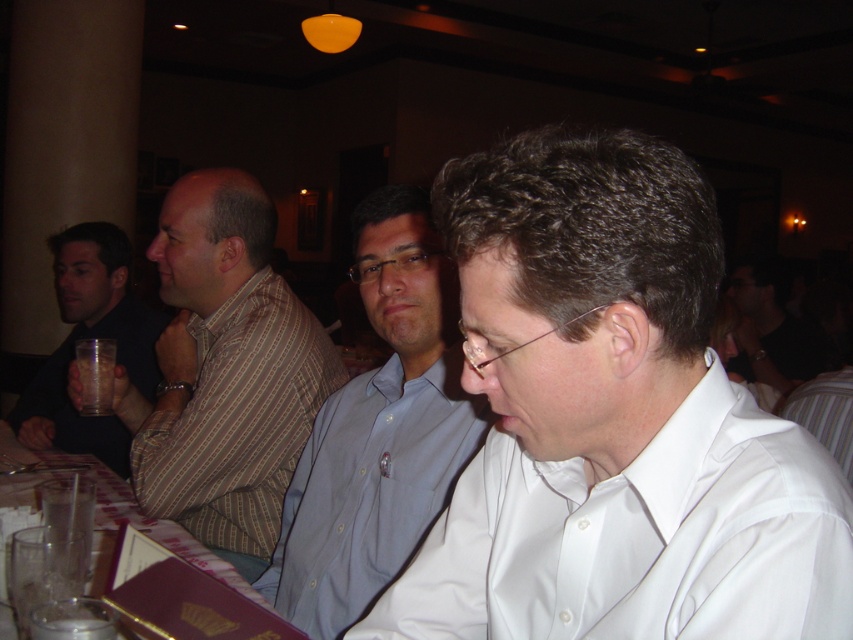
The image size is (853, 640). What are the coordinates of `translucent glass water at lower left` in the screenshot? It's located at (107, 506).

The height and width of the screenshot is (640, 853). Describe the element at coordinates (107, 506) in the screenshot. I see `translucent glass water at lower left` at that location.

Is point (206, 557) closer to camera compared to point (99, 349)?

Yes, it is.

The width and height of the screenshot is (853, 640). Find the location of `translucent glass water at lower left`. translucent glass water at lower left is located at coordinates (107, 506).

Is striped cotton shirt at left positioned at the back of white shirt at center?

No, it is not.

Is striped cotton shirt at left to the left of white shirt at center from the viewer's perspective?

Correct, you'll find striped cotton shirt at left to the left of white shirt at center.

Which is in front, point (165, 285) or point (781, 355)?

Positioned in front is point (165, 285).

The width and height of the screenshot is (853, 640). I want to click on striped cotton shirt at left, so coord(225,372).

Which is more to the left, blue button-down shirt at center or dark blue shirt at left?

dark blue shirt at left

What do you see at coordinates (378, 429) in the screenshot?
I see `blue button-down shirt at center` at bounding box center [378, 429].

Identify the location of blue button-down shirt at center. coord(378,429).